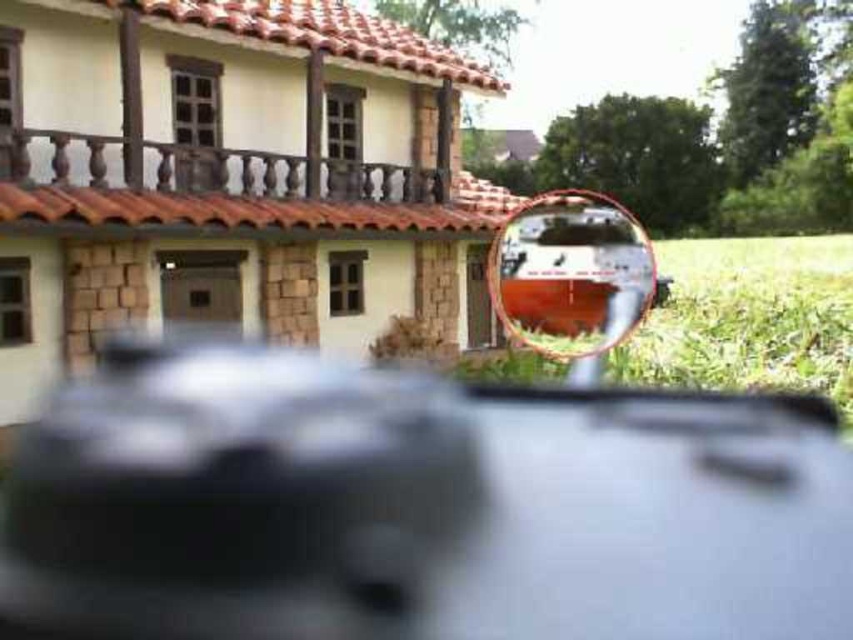
Question: Does metallic silver car at center have a larger size compared to clear glass rearview mirror at center?

Choices:
 (A) no
 (B) yes

Answer: (A)

Question: Which point appears farthest from the camera in this image?

Choices:
 (A) (177, 396)
 (B) (555, 216)
 (C) (780, 330)

Answer: (C)

Question: Does metallic silver car at center appear on the right side of green grass at lower right?

Choices:
 (A) yes
 (B) no

Answer: (B)

Question: Which of the following is the farthest from the observer?

Choices:
 (A) (595, 230)
 (B) (740, 305)
 (C) (3, 630)

Answer: (B)

Question: Is metallic silver car at center further to the viewer compared to green grass at lower right?

Choices:
 (A) no
 (B) yes

Answer: (B)

Question: Which point is farther to the camera?

Choices:
 (A) metallic silver car at center
 (B) clear glass rearview mirror at center
 (C) green grass at lower right

Answer: (A)